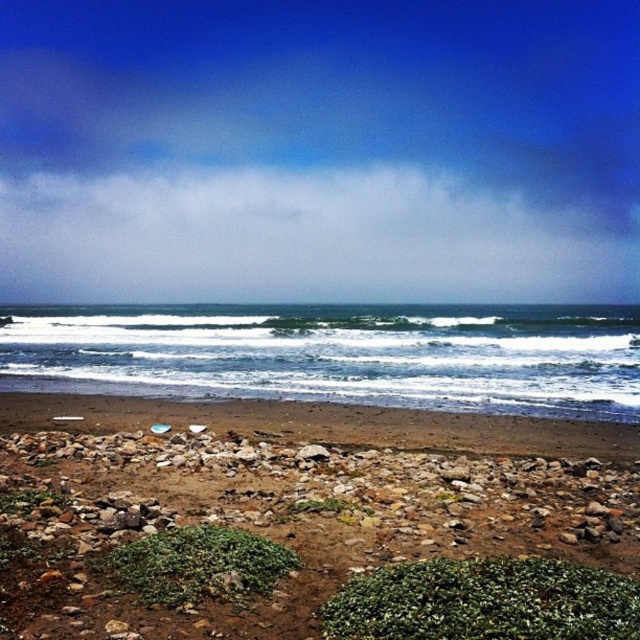
The height and width of the screenshot is (640, 640). In order to click on brown rocky beach at lower center in this screenshot , I will do [x=280, y=508].

Does point (608, 536) come closer to viewer compared to point (221, 365)?

That is True.

Find the location of a particular element. brown rocky beach at lower center is located at coordinates (280, 508).